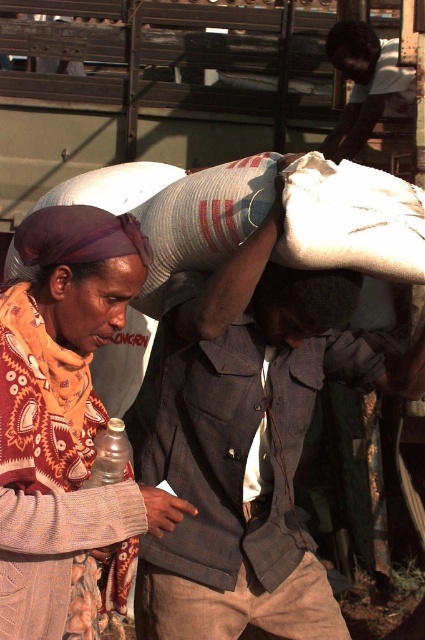
Question: Does knitted wool scarf at left appear over black hair at upper center?

Choices:
 (A) no
 (B) yes

Answer: (A)

Question: Which object is positioned farthest from the black hair at upper center?

Choices:
 (A) dark brown skin at center
 (B) purple fabric headscarf at center

Answer: (B)

Question: Which is farther from the knitted wool scarf at left?

Choices:
 (A) plaid fabric jacket at center
 (B) purple fabric headscarf at center
 (C) dark brown skin at center
 (D) black hair at upper center

Answer: (D)

Question: Based on their relative distances, which object is nearer to the dark brown skin at center?

Choices:
 (A) purple fabric headscarf at center
 (B) black hair at upper center

Answer: (B)

Question: Is knitted wool scarf at left closer to the viewer compared to purple fabric headscarf at center?

Choices:
 (A) yes
 (B) no

Answer: (A)

Question: Is the position of dark brown skin at center less distant than that of black hair at upper center?

Choices:
 (A) no
 (B) yes

Answer: (B)